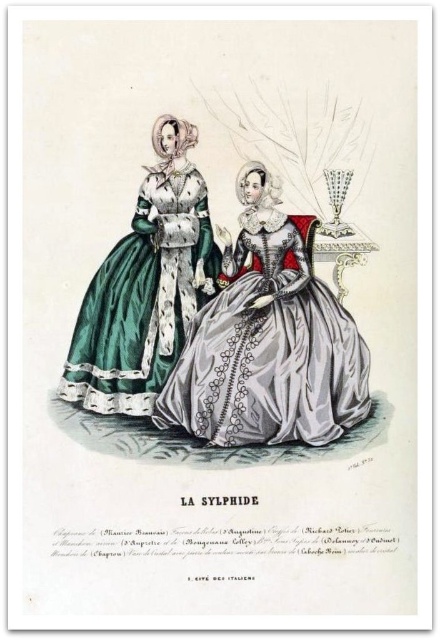
Can you confirm if silvery satin gown at center is smaller than green satin dress at left?

Actually, silvery satin gown at center might be larger than green satin dress at left.

This screenshot has height=640, width=440. Describe the element at coordinates (267, 339) in the screenshot. I see `silvery satin gown at center` at that location.

This screenshot has height=640, width=440. Find the location of `silvery satin gown at center`. silvery satin gown at center is located at coordinates (267, 339).